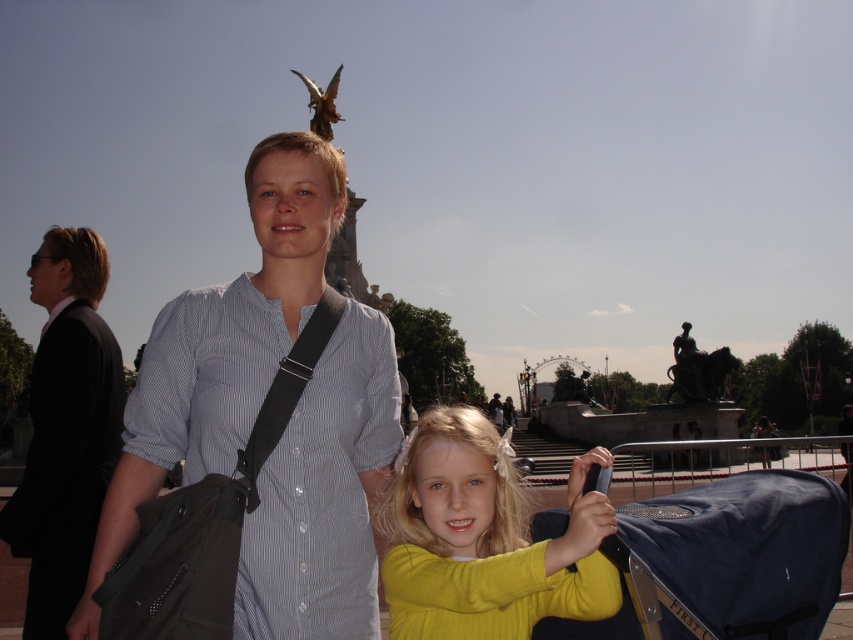
Who is taller, blue fabric baby carriage at lower right or matte black shirt at center?

Standing taller between the two is matte black shirt at center.

Is blue fabric baby carriage at lower right bigger than matte black shirt at center?

→ Yes, blue fabric baby carriage at lower right is bigger than matte black shirt at center.

Between point (698, 512) and point (84, 452), which one is positioned behind?

The point (84, 452) is behind.

Locate an element on the screen. blue fabric baby carriage at lower right is located at coordinates point(741,540).

From the picture: Does matte blue shirt at center appear over blue fabric baby carriage at lower right?

Indeed, matte blue shirt at center is positioned over blue fabric baby carriage at lower right.

Is matte blue shirt at center positioned in front of blue fabric baby carriage at lower right?

That is False.

I want to click on matte blue shirt at center, so click(x=222, y=346).

Does matte blue shirt at center have a lesser width compared to matte black shirt at center?

Incorrect, matte blue shirt at center's width is not less than matte black shirt at center's.

Between matte blue shirt at center and matte black shirt at center, which one has more height?

matte blue shirt at center is taller.

Identify the location of matte blue shirt at center. The width and height of the screenshot is (853, 640). (222, 346).